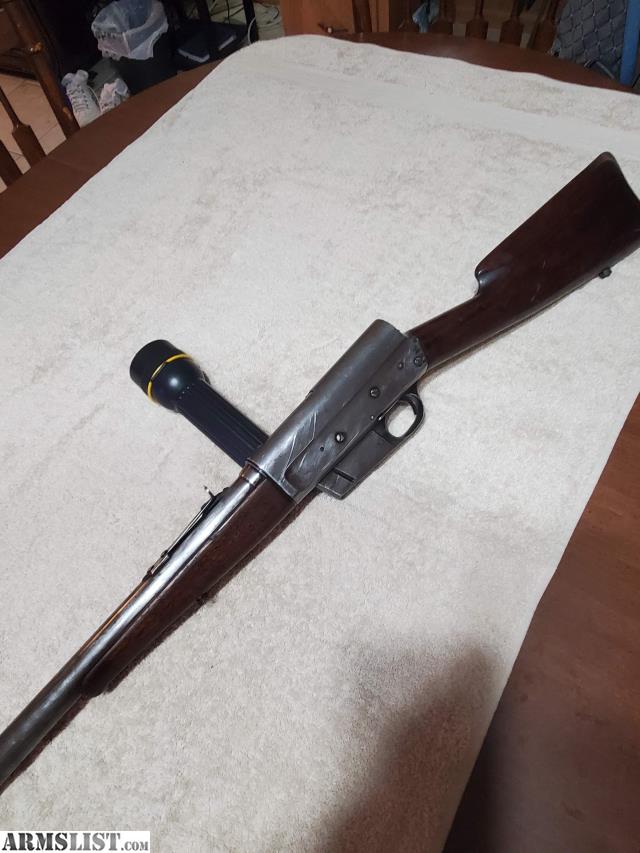
At what (x,y) coordinates should I click in order to perform the action: click on wooden table. Please return your answer as a coordinate pair (x, y). Looking at the image, I should click on click(95, 152).